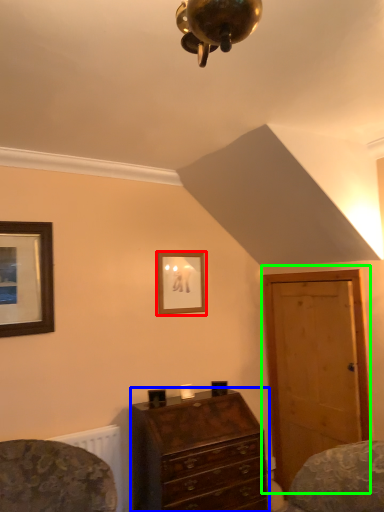
Question: Which is nearer to the picture frame (highlighted by a red box)? chest of drawers (highlighted by a blue box) or door (highlighted by a green box).

Choices:
 (A) chest of drawers
 (B) door

Answer: (B)